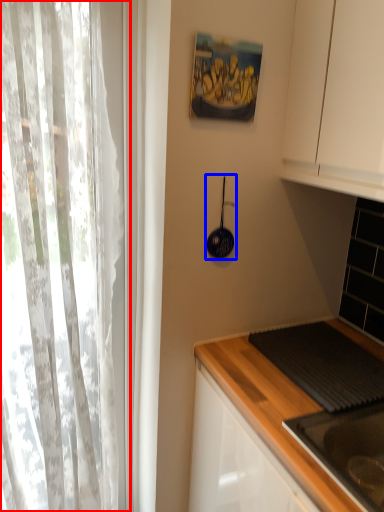
Question: Which point is closer to the camera, curtain (highlighted by a red box) or appliance (highlighted by a blue box)?

Choices:
 (A) curtain
 (B) appliance

Answer: (A)